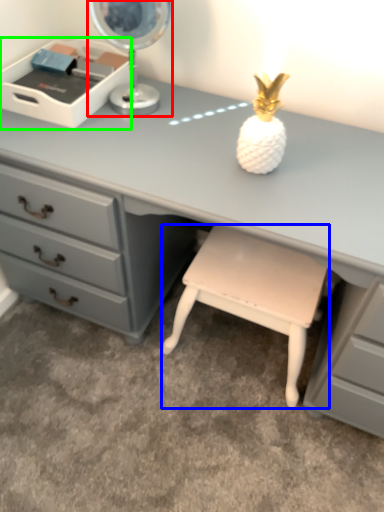
Question: Estimate the real-world distances between objects in this image. Which object is farther from table lamp (highlighted by a red box), stool (highlighted by a blue box) or writing desk (highlighted by a green box)?

Choices:
 (A) stool
 (B) writing desk

Answer: (A)